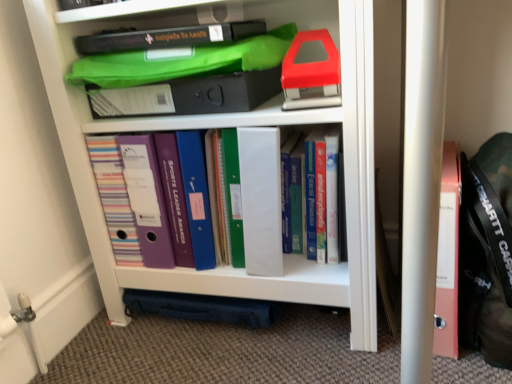
Question: Is there a large distance between white plastic shelf at center and matte plastic folders at center, the 3th book viewed from the right?

Choices:
 (A) yes
 (B) no

Answer: (B)

Question: Is white plastic shelf at center at the left side of matte plastic folders at center, the 1th book from the left?

Choices:
 (A) yes
 (B) no

Answer: (B)

Question: Considering the relative sizes of white plastic shelf at center and matte plastic folders at center, the 1th book from the left, in the image provided, is white plastic shelf at center smaller than matte plastic folders at center, the 1th book from the left,?

Choices:
 (A) no
 (B) yes

Answer: (A)

Question: Could matte plastic folders at center, the 1th book from the left, be considered to be inside white plastic shelf at center?

Choices:
 (A) no
 (B) yes

Answer: (B)

Question: From the image's perspective, does white plastic shelf at center appear higher than matte plastic folders at center, the 3th book viewed from the right?

Choices:
 (A) yes
 (B) no

Answer: (A)

Question: Is white plastic shelf at center in front of matte plastic folders at center, the 3th book viewed from the right?

Choices:
 (A) no
 (B) yes

Answer: (B)

Question: Is matte plastic folders at center, the 1th book from the left, positioned behind white plastic shelf at center?

Choices:
 (A) no
 (B) yes

Answer: (B)

Question: From the image's perspective, does matte plastic folders at center, the 3th book viewed from the right, appear higher than white plastic shelf at center?

Choices:
 (A) yes
 (B) no

Answer: (B)

Question: Is matte plastic folders at center, the 3th book viewed from the right, to the left of white plastic shelf at center from the viewer's perspective?

Choices:
 (A) yes
 (B) no

Answer: (A)

Question: Is the surface of matte plastic folders at center, the 3th book viewed from the right, in direct contact with white plastic shelf at center?

Choices:
 (A) no
 (B) yes

Answer: (B)

Question: Is the depth of matte plastic folders at center, the 3th book viewed from the right, less than that of white plastic shelf at center?

Choices:
 (A) yes
 (B) no

Answer: (B)

Question: Is matte plastic folders at center, the 3th book viewed from the right, outside of white plastic shelf at center?

Choices:
 (A) no
 (B) yes

Answer: (A)

Question: Is hardcover books at center, which is the 1th book in right-to-left order, with matte plastic folders at center, the 3th book viewed from the right?

Choices:
 (A) yes
 (B) no

Answer: (B)